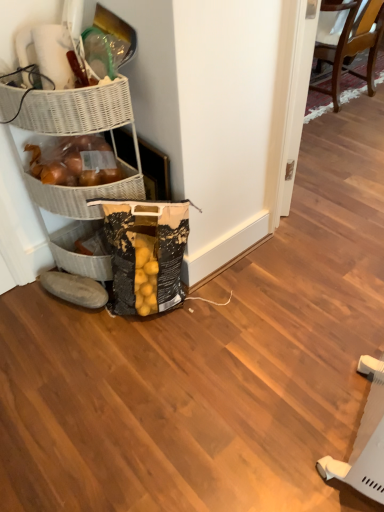
Question: Is black textured grocery bag at lower left at the right side of wooden chair at upper right?

Choices:
 (A) no
 (B) yes

Answer: (A)

Question: Does black textured grocery bag at lower left have a larger size compared to wooden chair at upper right?

Choices:
 (A) yes
 (B) no

Answer: (B)

Question: Can you see black textured grocery bag at lower left touching wooden chair at upper right?

Choices:
 (A) yes
 (B) no

Answer: (B)

Question: From a real-world perspective, does black textured grocery bag at lower left sit lower than wooden chair at upper right?

Choices:
 (A) no
 (B) yes

Answer: (B)

Question: Is black textured grocery bag at lower left oriented away from wooden chair at upper right?

Choices:
 (A) yes
 (B) no

Answer: (B)

Question: In the image, is black textured grocery bag at lower left positioned in front of or behind white wicker basket at upper left?

Choices:
 (A) front
 (B) behind

Answer: (A)

Question: In terms of width, does black textured grocery bag at lower left look wider or thinner when compared to white wicker basket at upper left?

Choices:
 (A) thin
 (B) wide

Answer: (A)

Question: In terms of size, does black textured grocery bag at lower left appear bigger or smaller than white wicker basket at upper left?

Choices:
 (A) small
 (B) big

Answer: (B)

Question: From the image's perspective, is black textured grocery bag at lower left positioned above or below white wicker basket at upper left?

Choices:
 (A) above
 (B) below

Answer: (B)

Question: From the image's perspective, relative to wooden chair at upper right, is gray fabric slipper at lower left above or below?

Choices:
 (A) above
 (B) below

Answer: (B)

Question: In the image, is gray fabric slipper at lower left on the left side or the right side of wooden chair at upper right?

Choices:
 (A) right
 (B) left

Answer: (B)

Question: Looking at their shapes, would you say gray fabric slipper at lower left is wider or thinner than wooden chair at upper right?

Choices:
 (A) thin
 (B) wide

Answer: (A)

Question: From their relative heights in the image, would you say gray fabric slipper at lower left is taller or shorter than wooden chair at upper right?

Choices:
 (A) short
 (B) tall

Answer: (A)

Question: From their relative heights in the image, would you say black textured grocery bag at lower left is taller or shorter than wooden chair at upper right?

Choices:
 (A) short
 (B) tall

Answer: (A)

Question: From the image's perspective, is black textured grocery bag at lower left located above or below wooden chair at upper right?

Choices:
 (A) above
 (B) below

Answer: (B)